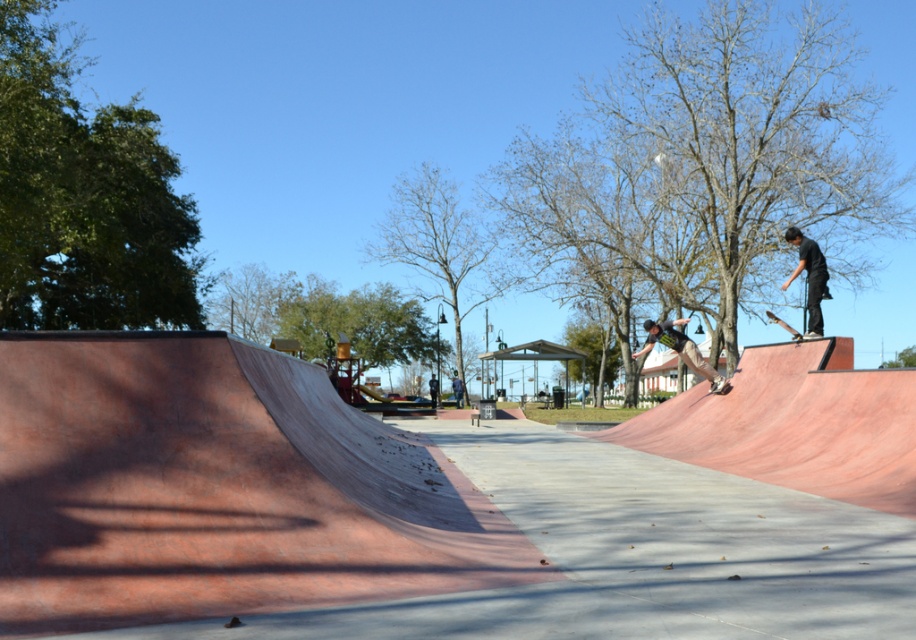
Question: Which is farther from the black matte skateboarder at right?

Choices:
 (A) matte black skateboarder at center
 (B) wooden skateboard at upper right
 (C) smooth red ramp at right
 (D) metallic silver skateboard at center

Answer: (B)

Question: Is smooth red ramp at right positioned behind metallic silver skateboard at center?

Choices:
 (A) yes
 (B) no

Answer: (B)

Question: Does black matte skateboarder at right have a larger size compared to metallic silver skateboard at center?

Choices:
 (A) no
 (B) yes

Answer: (A)

Question: Which of the following is the closest to the observer?

Choices:
 (A) (675, 348)
 (B) (766, 445)
 (C) (787, 330)

Answer: (B)

Question: Estimate the real-world distances between objects in this image. Which object is closer to the matte black skateboarder at center?

Choices:
 (A) black matte skateboarder at right
 (B) smooth red ramp at right
 (C) metallic silver skateboard at center

Answer: (C)

Question: Is smooth red ramp at right below black matte skateboarder at right?

Choices:
 (A) yes
 (B) no

Answer: (A)